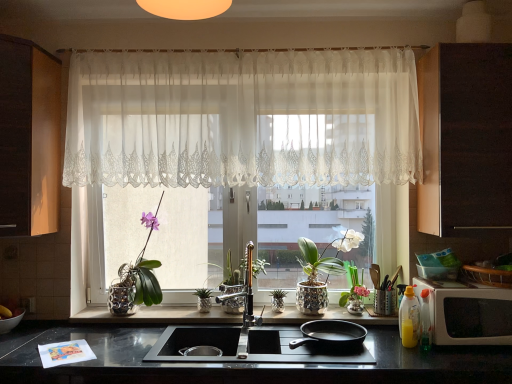
Question: From a real-world perspective, does metallic silver pot at center, positioned as the second plant in right-to-left order, stand above black matte frying pan at center?

Choices:
 (A) yes
 (B) no

Answer: (A)

Question: Does metallic silver pot at center, positioned as the second plant in right-to-left order, appear on the right side of black matte frying pan at center?

Choices:
 (A) no
 (B) yes

Answer: (A)

Question: Is metallic silver pot at center, which is the first plant from left to right, aimed at black matte frying pan at center?

Choices:
 (A) yes
 (B) no

Answer: (B)

Question: From the image's perspective, is metallic silver pot at center, which is the first plant from left to right, beneath black matte frying pan at center?

Choices:
 (A) no
 (B) yes

Answer: (A)

Question: Does metallic silver pot at center, which is the first plant from left to right, lie in front of black matte frying pan at center?

Choices:
 (A) no
 (B) yes

Answer: (A)

Question: Is metallic silver pot at center, positioned as the second plant in right-to-left order, surrounding black matte frying pan at center?

Choices:
 (A) no
 (B) yes

Answer: (A)

Question: Does pink glass vase at center, arranged as the 2th floral arrangement when viewed from the left, turn towards white glossy pot at center?

Choices:
 (A) no
 (B) yes

Answer: (B)

Question: Considering the relative sizes of pink glass vase at center, arranged as the 2th floral arrangement when viewed from the left, and white glossy pot at center in the image provided, is pink glass vase at center, arranged as the 2th floral arrangement when viewed from the left, wider than white glossy pot at center?

Choices:
 (A) yes
 (B) no

Answer: (B)

Question: From a real-world perspective, does pink glass vase at center, which is the first floral arrangement in right-to-left order, sit lower than white glossy pot at center?

Choices:
 (A) yes
 (B) no

Answer: (A)

Question: Is white glossy pot at center located within pink glass vase at center, arranged as the 2th floral arrangement when viewed from the left?

Choices:
 (A) no
 (B) yes

Answer: (A)

Question: Is the depth of pink glass vase at center, arranged as the 2th floral arrangement when viewed from the left, greater than that of white glossy pot at center?

Choices:
 (A) yes
 (B) no

Answer: (A)

Question: Can you confirm if pink glass vase at center, which is the first floral arrangement in right-to-left order, is bigger than white glossy pot at center?

Choices:
 (A) yes
 (B) no

Answer: (B)

Question: Could you tell me if matte wood cabinet at left, positioned as the 1th cabinetry in left-to-right order, is turned towards green metallic pineapple at center, the 1th plant from the right?

Choices:
 (A) no
 (B) yes

Answer: (B)